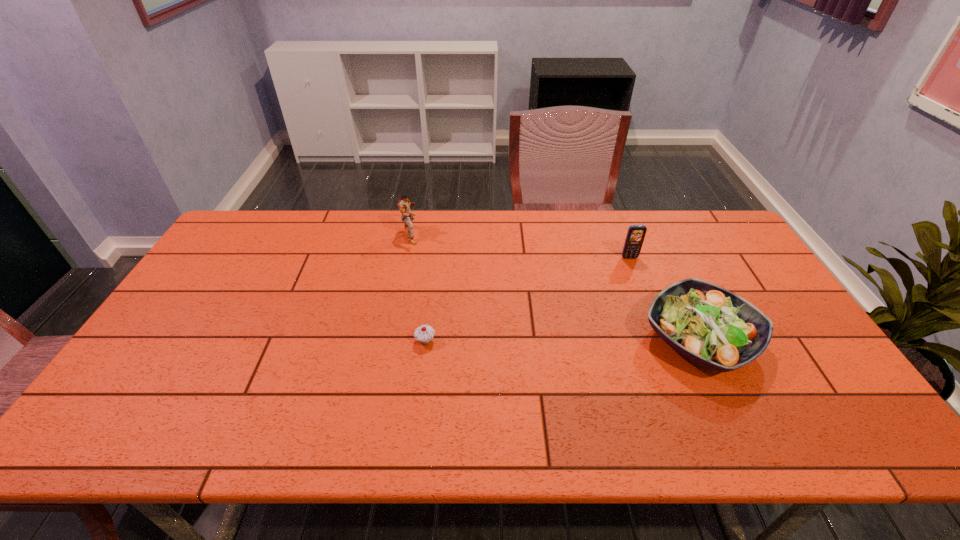
This screenshot has height=540, width=960. Find the location of `free space between the salad plate and the second object from left to right`. free space between the salad plate and the second object from left to right is located at coordinates (563, 341).

This screenshot has width=960, height=540. I want to click on free space between the tallest object and the cupcake, so [x=419, y=288].

I want to click on free spot between the third shortest object and the leftmost object, so click(x=520, y=246).

This screenshot has height=540, width=960. What are the coordinates of `unoccupied area between the second shortest object and the leftmost object` in the screenshot? It's located at (555, 287).

Locate an element on the screen. The image size is (960, 540). free space between the second shortest object and the tallest object is located at coordinates (x=555, y=287).

Find the location of a particular element. This screenshot has width=960, height=540. free space between the third nearest object and the second object from left to right is located at coordinates (527, 299).

Identify which object is the second closest to the puncher. Please provide its 2D coordinates. Your answer should be formatted as a tuple, i.e. [(x, y)], where the tuple contains the x and y coordinates of a point satisfying the conditions above.

[(635, 236)]

Identify which object is the nearest to the third tallest object. Please provide its 2D coordinates. Your answer should be formatted as a tuple, i.e. [(x, y)], where the tuple contains the x and y coordinates of a point satisfying the conditions above.

[(635, 236)]

The height and width of the screenshot is (540, 960). Identify the location of blank space that satisfies the following two spatial constraints: 1. on the front-facing side of the second shortest object; 2. on the right side of the puncher. (390, 340).

At what (x,y) coordinates should I click in order to perform the action: click on blank space that satisfies the following two spatial constraints: 1. on the screen of the salad plate; 2. on the right side of the cellular telephone. Please return your answer as a coordinate pair (x, y). Looking at the image, I should click on (661, 340).